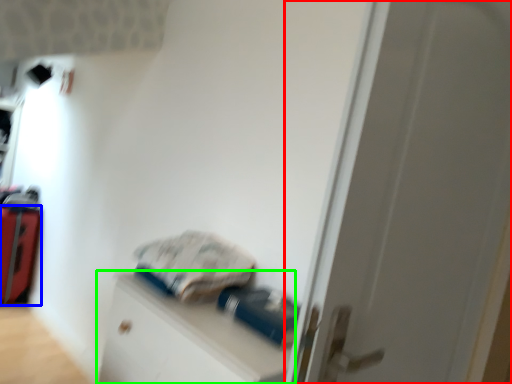
Question: Estimate the real-world distances between objects in this image. Which object is closer to door (highlighted by a red box), luggage (highlighted by a blue box) or file cabinet (highlighted by a green box)?

Choices:
 (A) luggage
 (B) file cabinet

Answer: (B)